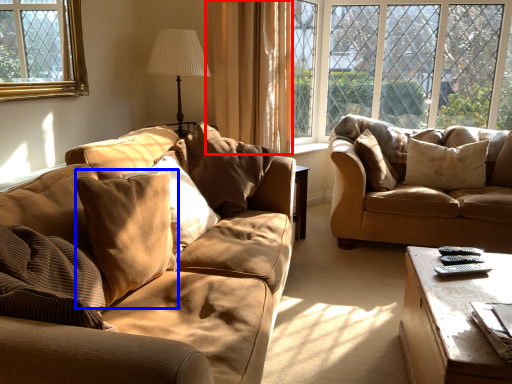
Question: Which object appears farthest to the camera in this image, curtain (highlighted by a red box) or pillow (highlighted by a blue box)?

Choices:
 (A) curtain
 (B) pillow

Answer: (A)